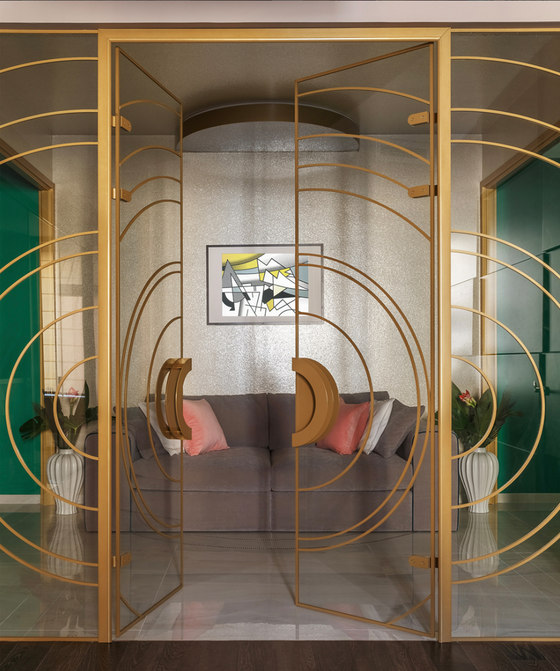
The width and height of the screenshot is (560, 671). In order to click on sofa pillows in this screenshot , I will do `click(176, 448)`, `click(200, 444)`, `click(357, 435)`, `click(373, 429)`, `click(401, 429)`, `click(150, 450)`.